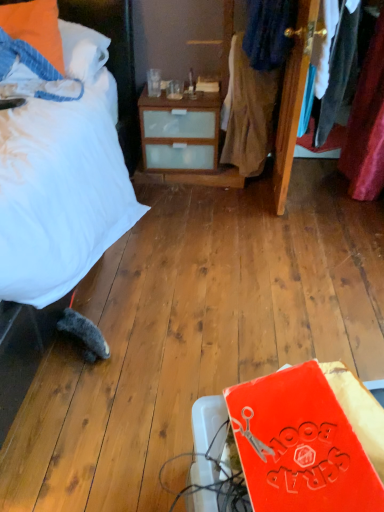
Where is `vacant region above rubberized orange book at lower right (from a real-world perspective)`? This screenshot has height=512, width=384. vacant region above rubberized orange book at lower right (from a real-world perspective) is located at coordinates pyautogui.click(x=327, y=436).